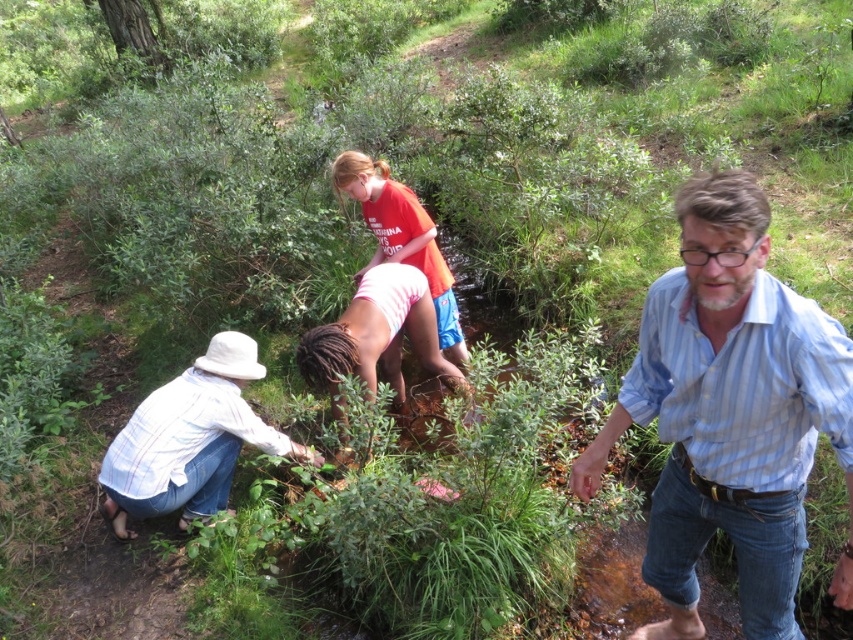
Between blue striped shirt at center and pink fabric at center, which one has more height?

With more height is blue striped shirt at center.

Does point (726, 307) come in front of point (431, 314)?

Yes.

The height and width of the screenshot is (640, 853). I want to click on blue striped shirt at center, so click(x=730, y=413).

Can you confirm if white plaid shirt at lower left is positioned to the left of matte red shirt at center?

Yes, white plaid shirt at lower left is to the left of matte red shirt at center.

Which is in front, point (102, 470) or point (399, 253)?

Point (102, 470)

Identify the location of white plaid shirt at lower left. This screenshot has height=640, width=853. (190, 440).

Consider the image. Can you confirm if white plaid shirt at lower left is positioned to the left of pink fabric at center?

Yes, white plaid shirt at lower left is to the left of pink fabric at center.

Is point (132, 468) closer to camera compared to point (421, 324)?

Yes, point (132, 468) is closer to viewer.

Locate an element on the screen. This screenshot has height=640, width=853. white plaid shirt at lower left is located at coordinates point(190,440).